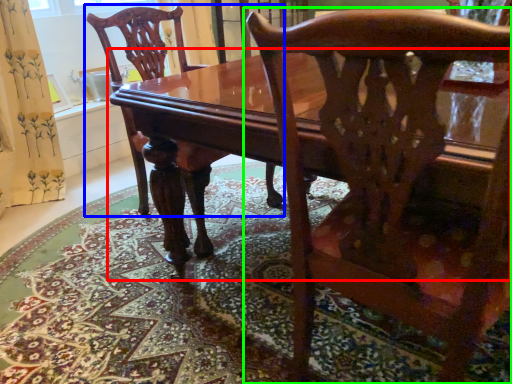
Question: Which object is the farthest from table (highlighted by a red box)? Choose among these: chair (highlighted by a blue box) or chair (highlighted by a green box).

Choices:
 (A) chair
 (B) chair

Answer: (A)